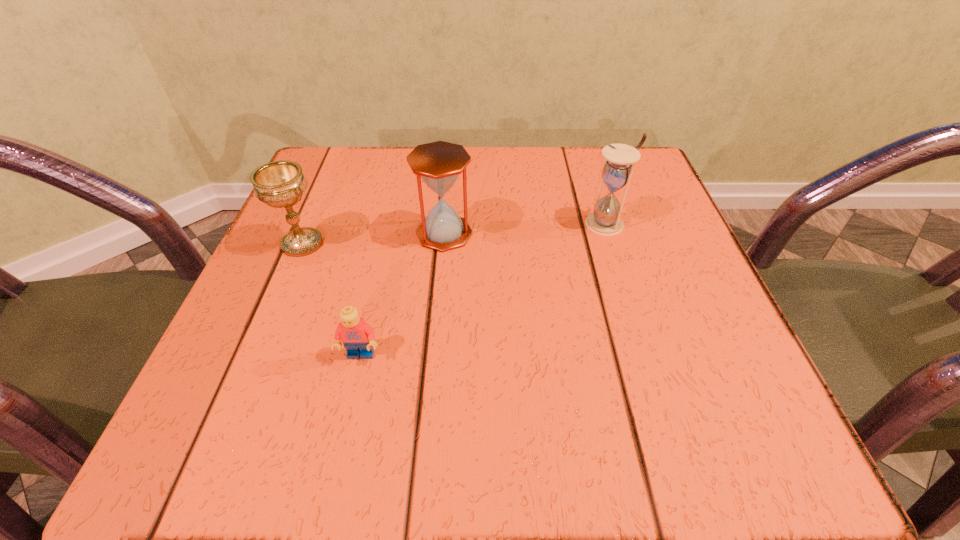
Where is `the rightmost object`? The width and height of the screenshot is (960, 540). the rightmost object is located at coordinates (605, 220).

This screenshot has width=960, height=540. In order to click on the left hourglass in this screenshot , I will do `click(438, 164)`.

You are a GUI agent. You are given a task and a screenshot of the screen. Output one action in this format:
    pyautogui.click(x=<x>, y=<y>)
    Task: Click on the leftmost object
    The height and width of the screenshot is (540, 960).
    Given the screenshot: What is the action you would take?
    pyautogui.click(x=278, y=184)

The image size is (960, 540). I want to click on the nearest object, so click(357, 336).

Find the location of a particular element. Image resolution: width=960 pixels, height=540 pixels. the second object from left to right is located at coordinates (357, 336).

Find the location of a particular element. The width and height of the screenshot is (960, 540). free location located 0.070m on the front of the right hourglass is located at coordinates (618, 262).

Identify the location of free location located on the right of the left hourglass. (652, 234).

Where is `vacant region located 0.340m on the front of the leftmost object`? This screenshot has width=960, height=540. vacant region located 0.340m on the front of the leftmost object is located at coordinates (213, 456).

Find the location of a particular element. Image resolution: width=960 pixels, height=540 pixels. free space located 0.060m on the face of the Lego is located at coordinates (349, 404).

What are the coordinates of `object that is at the far edge` in the screenshot? It's located at (605, 220).